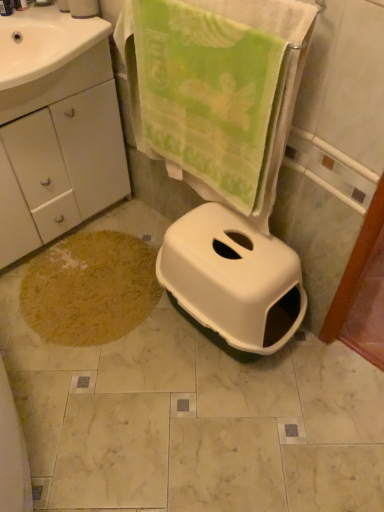
Question: From the image's perspective, is yellow textured bath mat at lower left positioned above or below white glossy sink at upper left?

Choices:
 (A) below
 (B) above

Answer: (A)

Question: Would you say yellow textured bath mat at lower left is to the left or to the right of white glossy sink at upper left in the picture?

Choices:
 (A) right
 (B) left

Answer: (A)

Question: Which is farther from the white matte toilet paper at upper left?

Choices:
 (A) white matte cabinet at lower left
 (B) green soft towel at upper center
 (C) yellow textured bath mat at lower left
 (D) white plastic toilet at center
 (E) white glossy sink at upper left

Answer: (D)

Question: Which object is the closest to the green soft towel at upper center?

Choices:
 (A) white glossy sink at upper left
 (B) yellow textured bath mat at lower left
 (C) white matte cabinet at lower left
 (D) white plastic toilet at center
 (E) white matte toilet paper at upper left

Answer: (D)